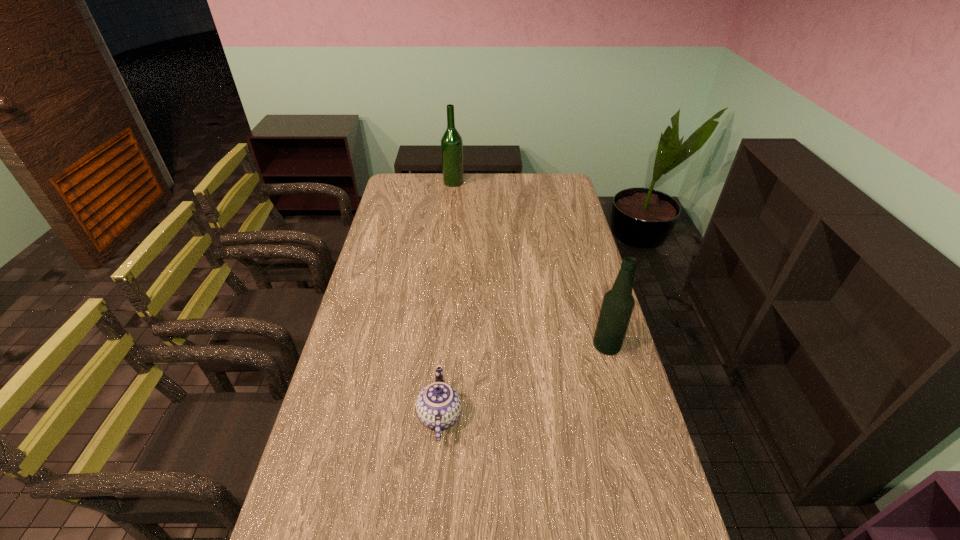
This screenshot has width=960, height=540. In order to click on object that is at the right edge in this screenshot , I will do `click(618, 303)`.

You are a GUI agent. You are given a task and a screenshot of the screen. Output one action in this format:
    pyautogui.click(x=<x>, y=<y>)
    Task: Click on the vacant area at the far edge
    The image size is (960, 540).
    Given the screenshot: What is the action you would take?
    pyautogui.click(x=507, y=184)

At what (x,y) coordinates should I click in order to perform the action: click on vacant region at the left edge of the desktop. Please return your answer as a coordinate pair (x, y). Looking at the image, I should click on (348, 450).

This screenshot has width=960, height=540. In the image, there is a desktop. Find the location of `vacant space at the right edge`. vacant space at the right edge is located at coordinates click(x=563, y=241).

The image size is (960, 540). What are the coordinates of `vacant position at the far left corner of the desktop` in the screenshot? It's located at (402, 193).

Locate an element on the screen. vacant position at the far right corner of the desktop is located at coordinates (555, 197).

Image resolution: width=960 pixels, height=540 pixels. In order to click on vacant region between the nearer alcohol and the nearest object in this screenshot , I will do `click(523, 381)`.

Locate an element on the screen. This screenshot has height=540, width=960. vacant area that lies between the farthest object and the right alcohol is located at coordinates (530, 265).

Image resolution: width=960 pixels, height=540 pixels. I want to click on empty space that is in between the shortest object and the farthest object, so click(446, 299).

Find the location of a particular element. This screenshot has height=540, width=960. free space between the rightmost object and the nearest object is located at coordinates (523, 381).